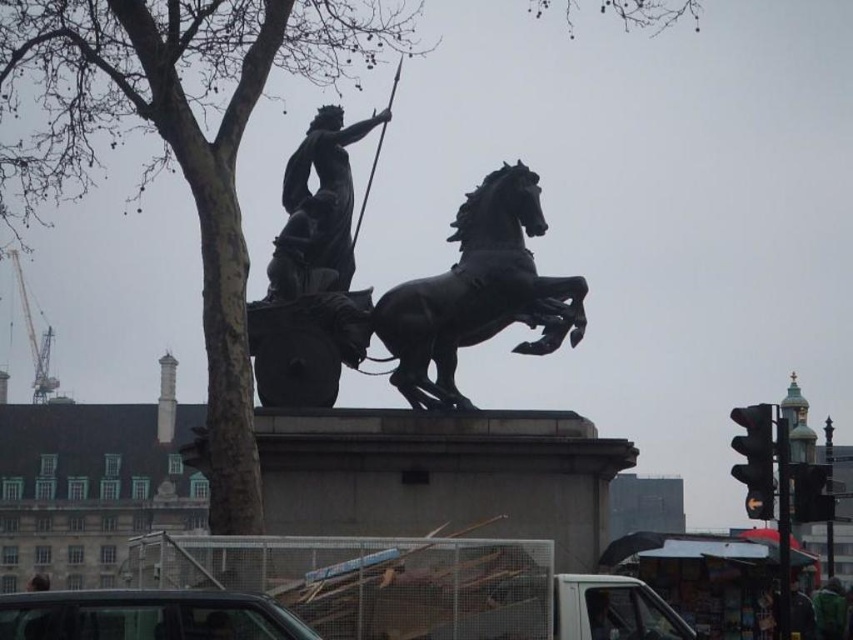
You are a tour guide explaining the statue to visitors. You mention the polished bronze horse at center and the bronze statue at center. Which one is larger in size?

The polished bronze horse at center is bigger than the bronze statue at center.

You are a tour guide leading a group around the public square. You point to the statue and ask your group, which part of the statue is lower in position between the polished bronze horse at center and the bronze statue at center?

The polished bronze horse at center is positioned under the bronze statue at center, so it is lower in position.

You are a photographer wanting to capture the bronze statue at center without any obstructions. You notice the bare wood tree at upper left in the background. Can you adjust your position to ensure the tree is not blocking the statue?

The bare wood tree at upper left is in front of the bronze statue at center, so moving your position to the side or behind the statue would allow you to frame the statue without the tree obstructing it.